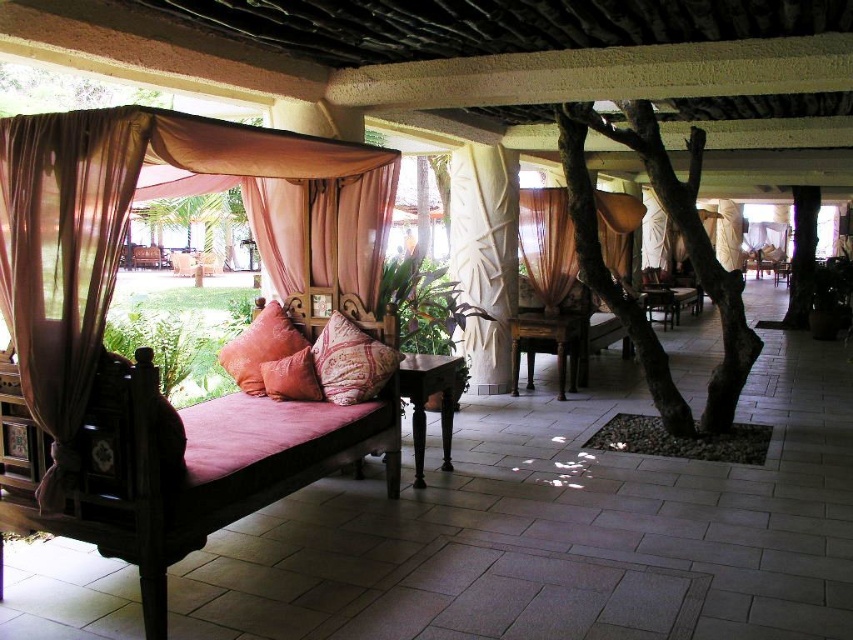
Is pink sheer curtain at center closer to camera compared to sheer beige curtain at center?

Yes, pink sheer curtain at center is in front of sheer beige curtain at center.

Which is behind, point (283, 273) or point (622, 243)?

Positioned behind is point (622, 243).

Which is behind, point (332, 268) or point (595, 202)?

The point (595, 202) is more distant.

Find the location of a particular element. pink sheer curtain at center is located at coordinates (325, 227).

Is sheer beige curtain at center wider than patterned fabric pillow at center?

Indeed, sheer beige curtain at center has a greater width compared to patterned fabric pillow at center.

Is the position of sheer beige curtain at center more distant than that of patterned fabric pillow at center?

Yes, sheer beige curtain at center is further from the viewer.

Describe the element at coordinates (547, 243) in the screenshot. I see `sheer beige curtain at center` at that location.

At what (x,y) coordinates should I click in order to perform the action: click on sheer beige curtain at center. Please return your answer as a coordinate pair (x, y). Looking at the image, I should click on (547, 243).

Which is below, patterned fabric pillow at center or textured orange pillow at center?

patterned fabric pillow at center is below.

Which of these two, patterned fabric pillow at center or textured orange pillow at center, stands shorter?

patterned fabric pillow at center

The image size is (853, 640). I want to click on patterned fabric pillow at center, so click(351, 362).